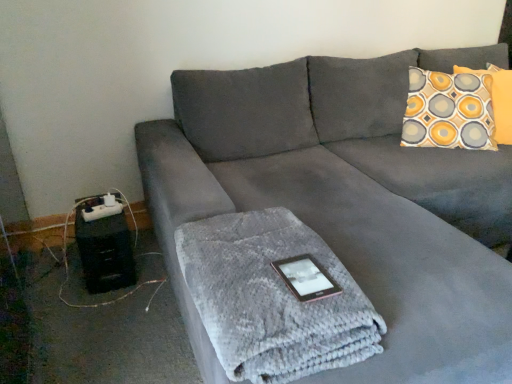
Question: Can you confirm if pink glossy tablet at center is wider than suede gray couch at center?

Choices:
 (A) yes
 (B) no

Answer: (B)

Question: Can you confirm if pink glossy tablet at center is smaller than suede gray couch at center?

Choices:
 (A) yes
 (B) no

Answer: (A)

Question: From a real-world perspective, is pink glossy tablet at center positioned over suede gray couch at center based on gravity?

Choices:
 (A) yes
 (B) no

Answer: (A)

Question: Does pink glossy tablet at center appear on the left side of suede gray couch at center?

Choices:
 (A) yes
 (B) no

Answer: (A)

Question: Does pink glossy tablet at center have a lesser width compared to suede gray couch at center?

Choices:
 (A) yes
 (B) no

Answer: (A)

Question: Based on their sizes in the image, would you say pink glossy tablet at center is bigger or smaller than yellow and gray patterned pillow at upper right?

Choices:
 (A) small
 (B) big

Answer: (A)

Question: In terms of width, does pink glossy tablet at center look wider or thinner when compared to yellow and gray patterned pillow at upper right?

Choices:
 (A) thin
 (B) wide

Answer: (A)

Question: Considering the relative positions of pink glossy tablet at center and yellow and gray patterned pillow at upper right in the image provided, is pink glossy tablet at center to the left or to the right of yellow and gray patterned pillow at upper right?

Choices:
 (A) left
 (B) right

Answer: (A)

Question: Relative to yellow and gray patterned pillow at upper right, is pink glossy tablet at center in front or behind?

Choices:
 (A) behind
 (B) front

Answer: (B)

Question: Is yellow and gray patterned pillow at upper right taller or shorter than patterned fabric pillow at upper right?

Choices:
 (A) short
 (B) tall

Answer: (B)

Question: Considering their positions, is yellow and gray patterned pillow at upper right located in front of or behind patterned fabric pillow at upper right?

Choices:
 (A) behind
 (B) front

Answer: (B)

Question: Is yellow and gray patterned pillow at upper right wider or thinner than patterned fabric pillow at upper right?

Choices:
 (A) thin
 (B) wide

Answer: (A)

Question: From the image's perspective, relative to patterned fabric pillow at upper right, is yellow and gray patterned pillow at upper right above or below?

Choices:
 (A) above
 (B) below

Answer: (B)

Question: From a real-world perspective, is yellow and gray patterned pillow at upper right positioned above or below pink glossy tablet at center?

Choices:
 (A) above
 (B) below

Answer: (A)

Question: Is yellow and gray patterned pillow at upper right taller or shorter than pink glossy tablet at center?

Choices:
 (A) tall
 (B) short

Answer: (A)